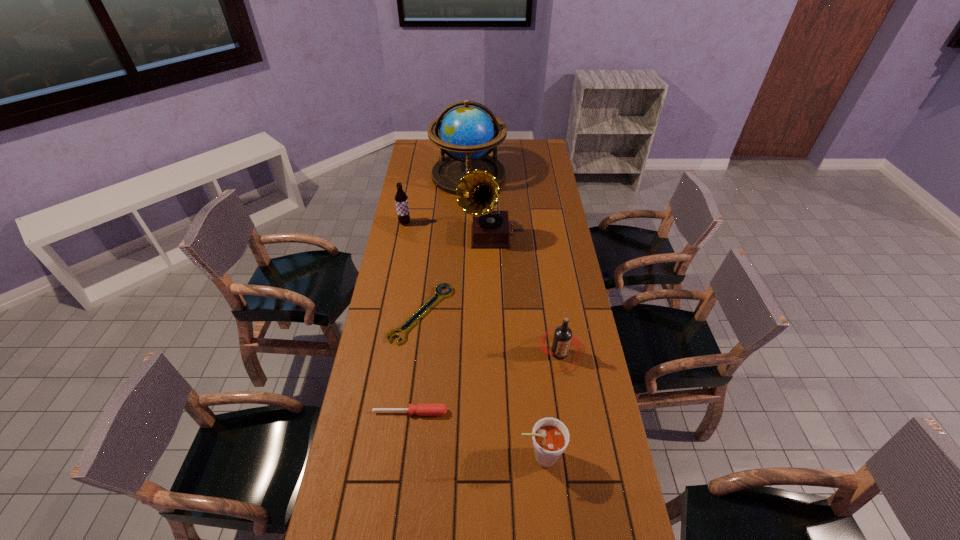
Locate an element on the screen. object that is at the far edge is located at coordinates (467, 134).

You are a GUI agent. You are given a task and a screenshot of the screen. Output one action in this format:
    pyautogui.click(x=<x>, y=<y>)
    Task: Click on the globe that is at the left edge
    
    Given the screenshot: What is the action you would take?
    pyautogui.click(x=467, y=134)

The image size is (960, 540). Find the location of `root beer present at the left edge`. root beer present at the left edge is located at coordinates (401, 199).

Find the location of a particular element. Image resolution: width=960 pixels, height=540 pixels. screwdriver at the left edge is located at coordinates (421, 409).

Where is `wrench that is positioned at the left edge`? The image size is (960, 540). wrench that is positioned at the left edge is located at coordinates (430, 303).

Where is `object at the far left corner`? This screenshot has height=540, width=960. object at the far left corner is located at coordinates (467, 134).

Find the location of a particular element. vacant space at the left edge is located at coordinates (398, 332).

In the image, there is a desktop. Where is `vacant region at the right edge`? This screenshot has height=540, width=960. vacant region at the right edge is located at coordinates (572, 259).

Where is `blank area at the far left corner`? Image resolution: width=960 pixels, height=540 pixels. blank area at the far left corner is located at coordinates (434, 146).

In the image, there is a desktop. At what (x,y) coordinates should I click in order to perform the action: click on vacant space at the far right corner. Please return your answer as a coordinate pair (x, y). The height and width of the screenshot is (540, 960). Looking at the image, I should click on (545, 160).